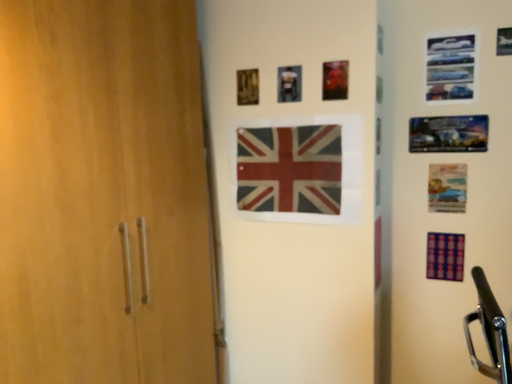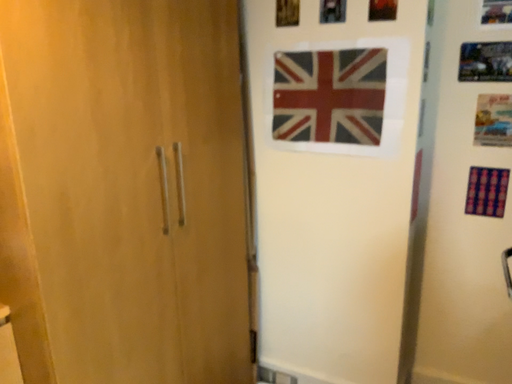
Question: Which way did the camera rotate in the video?

Choices:
 (A) rotated upward
 (B) rotated downward

Answer: (B)